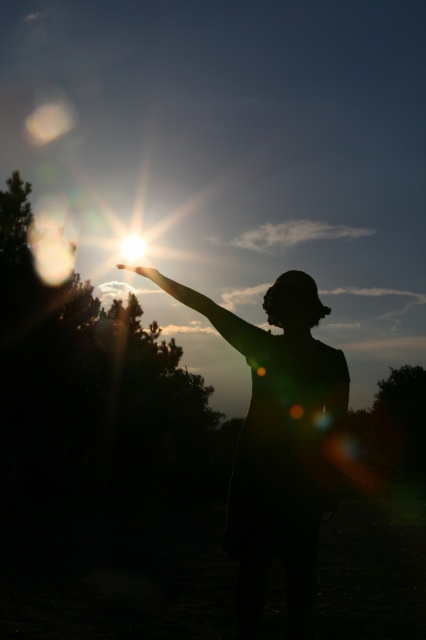
Measure the distance between point (x=316, y=460) and camera.

Point (x=316, y=460) and camera are 5.11 meters apart from each other.

Which is behind, point (296, 326) or point (253, 339)?

The point (296, 326) is more distant.

Identify the location of silhouette fabric at center. (279, 444).

Who is positioned more to the right, silhouette arm at upper center or transparent glass hand at upper center?

silhouette arm at upper center is more to the right.

Measure the distance between silhouette arm at upper center and camera.

silhouette arm at upper center and camera are 5.20 meters apart.

Locate an element on the screen. Image resolution: width=426 pixels, height=640 pixels. silhouette arm at upper center is located at coordinates (218, 317).

At what (x,y) coordinates should I click in order to perform the action: click on silhouette fabric at center. Please return your answer as a coordinate pair (x, y). Image resolution: width=426 pixels, height=640 pixels. Looking at the image, I should click on (279, 444).

At what (x,y) coordinates should I click in order to perform the action: click on silhouette fabric at center. Please return your answer as a coordinate pair (x, y). The height and width of the screenshot is (640, 426). Looking at the image, I should click on (279, 444).